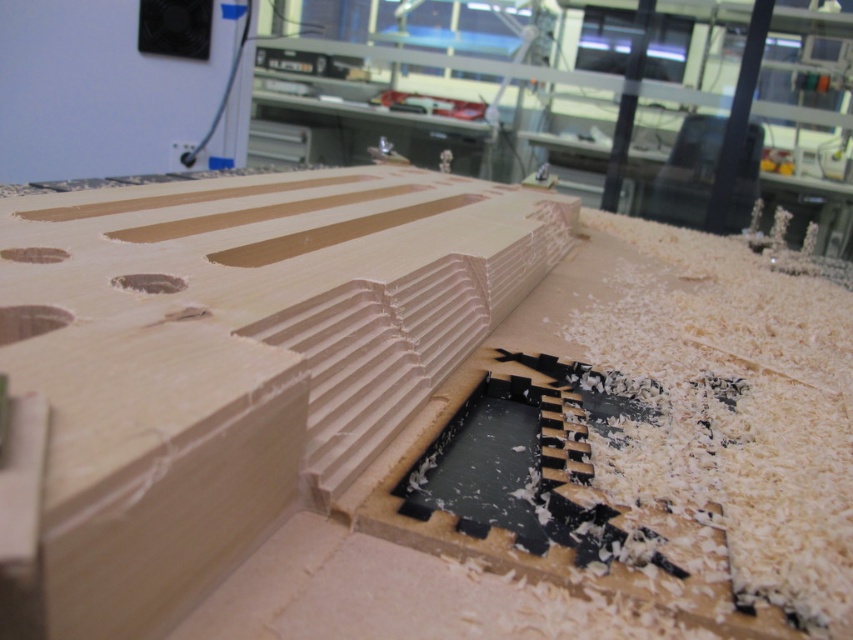
You are a carpenter working on a wooden project. You have two holes in the wood, the light brown wood hole at center and the matte wood hole at upper left. Which hole is located below the other?

The light brown wood hole at center is positioned under the matte wood hole at upper left, so the light brown wood hole is below the matte wood hole.

You are an apprentice woodworker examining the light brown wood hole at center and the matte wood hole at upper left. Which hole is located to the right of the other?

The light brown wood hole at center is positioned on the right side of the matte wood hole at upper left.

You are standing in a woodworking workshop and see two points marked on a piece of wood on the workbench. The points are labeled as point [171,280] and point [45,253]. Which point is closer to you?

Point [171,280] is closer to the viewer than point [45,253].